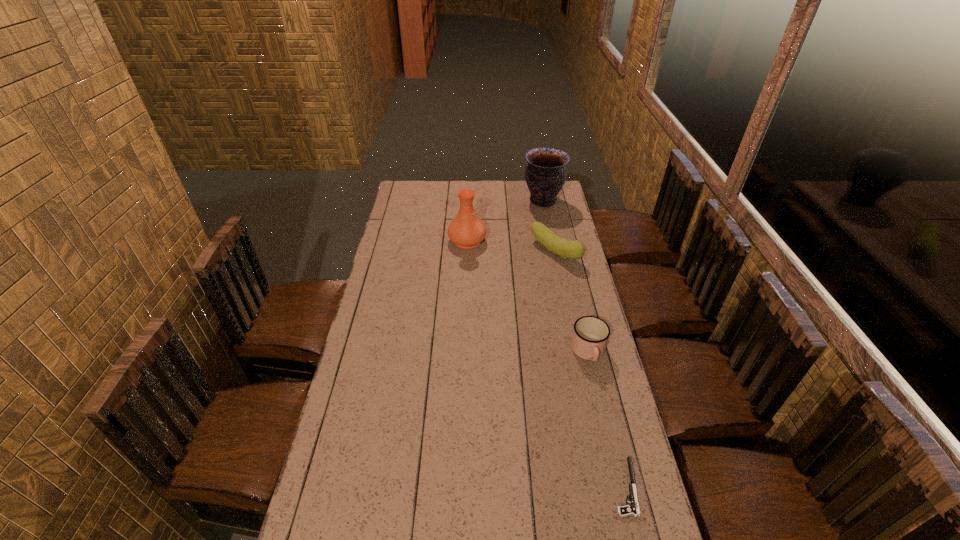
At what (x,y) coordinates should I click in order to perform the action: click on free spot between the vase and the farthest object. Please return your answer as a coordinate pair (x, y). Image resolution: width=960 pixels, height=540 pixels. Looking at the image, I should click on (505, 221).

What are the coordinates of `vacant area that lies between the cucumber and the nearest object` in the screenshot? It's located at (590, 369).

Identify the location of free area in between the vase and the farthest object. (505, 221).

Where is `vacant area between the vase and the mug`? vacant area between the vase and the mug is located at coordinates (528, 296).

The width and height of the screenshot is (960, 540). Identify the location of free space between the mug and the shortest object. (607, 420).

At what (x,y) coordinates should I click in order to perform the action: click on object that ranks as the third closest to the pottery. Please return your answer as a coordinate pair (x, y). Looking at the image, I should click on (590, 335).

Where is `the second closest object relative to the cucumber`? the second closest object relative to the cucumber is located at coordinates (466, 230).

I want to click on free space in the image that satisfies the following two spatial constraints: 1. on the front handle of the pottery; 2. on the left side of the cucumber, so click(x=553, y=252).